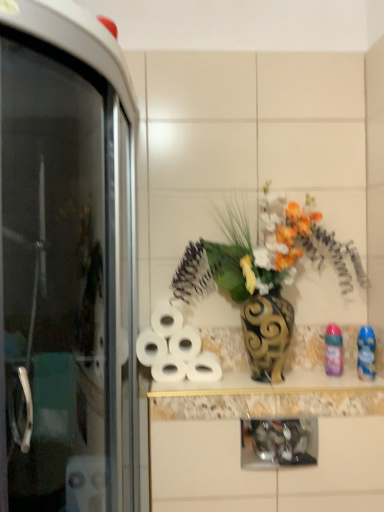
Question: Is white matte toilet paper at center, which is counted as the 2th toilet paper, starting from the top, not near white matte toilet paper at center, marked as the 3th toilet paper in a top-to-bottom arrangement?

Choices:
 (A) no
 (B) yes

Answer: (A)

Question: Are white matte toilet paper at center, arranged as the 4th toilet paper when ordered from the bottom, and white matte toilet paper at center, positioned as the 3th toilet paper in bottom-to-top order, beside each other?

Choices:
 (A) no
 (B) yes

Answer: (B)

Question: From the image's perspective, does white matte toilet paper at center, arranged as the 4th toilet paper when ordered from the bottom, appear higher than white matte toilet paper at center, marked as the 3th toilet paper in a top-to-bottom arrangement?

Choices:
 (A) no
 (B) yes

Answer: (B)

Question: From a real-world perspective, is white matte toilet paper at center, arranged as the 4th toilet paper when ordered from the bottom, physically above white matte toilet paper at center, positioned as the 3th toilet paper in bottom-to-top order?

Choices:
 (A) no
 (B) yes

Answer: (B)

Question: Is white matte toilet paper at center, arranged as the 4th toilet paper when ordered from the bottom, positioned beyond the bounds of white matte toilet paper at center, marked as the 3th toilet paper in a top-to-bottom arrangement?

Choices:
 (A) yes
 (B) no

Answer: (A)

Question: Does white matte toilet paper at center, which is counted as the 2th toilet paper, starting from the top, have a lesser width compared to white matte toilet paper at center, marked as the 3th toilet paper in a top-to-bottom arrangement?

Choices:
 (A) no
 (B) yes

Answer: (A)

Question: From the image's perspective, is transparent glass screen door at left above white matte toilet paper at center, the 2th toilet paper in the bottom-to-top sequence?

Choices:
 (A) yes
 (B) no

Answer: (A)

Question: Is transparent glass screen door at left next to white matte toilet paper at center, the 2th toilet paper in the bottom-to-top sequence?

Choices:
 (A) yes
 (B) no

Answer: (B)

Question: Can you confirm if transparent glass screen door at left is smaller than white matte toilet paper at center, the 4th toilet paper in the top-to-bottom sequence?

Choices:
 (A) yes
 (B) no

Answer: (B)

Question: Is the position of transparent glass screen door at left more distant than that of white matte toilet paper at center, the 4th toilet paper in the top-to-bottom sequence?

Choices:
 (A) yes
 (B) no

Answer: (B)

Question: From a real-world perspective, is transparent glass screen door at left beneath white matte toilet paper at center, the 4th toilet paper in the top-to-bottom sequence?

Choices:
 (A) no
 (B) yes

Answer: (A)

Question: From a real-world perspective, is transparent glass screen door at left physically above white matte toilet paper at center, the 2th toilet paper in the bottom-to-top sequence?

Choices:
 (A) yes
 (B) no

Answer: (A)

Question: Is transparent glass screen door at left bigger than white matte toilet paper at center, marked as the 3th toilet paper in a top-to-bottom arrangement?

Choices:
 (A) yes
 (B) no

Answer: (A)